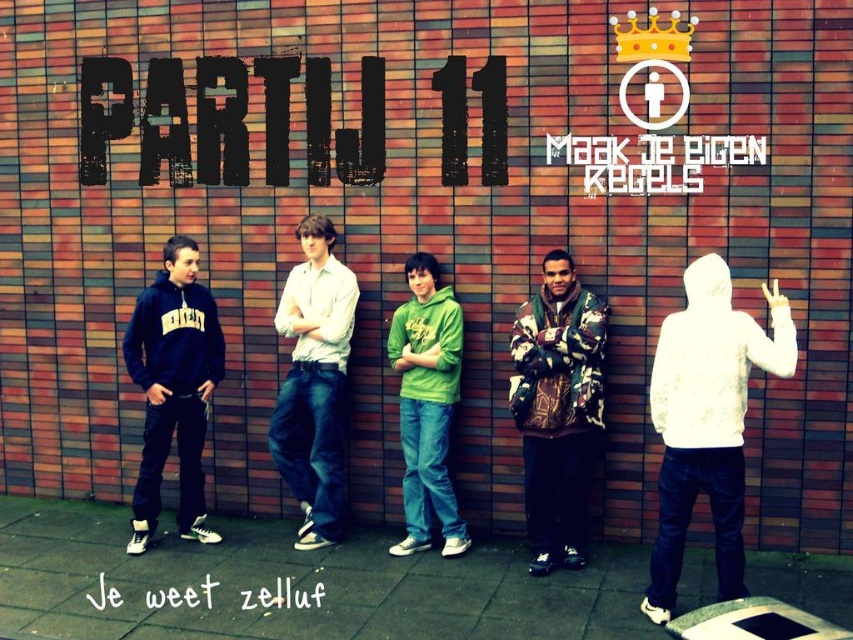
Question: Does white hoodie at center appear under light beige shirt at center?

Choices:
 (A) yes
 (B) no

Answer: (A)

Question: Estimate the real-world distances between objects in this image. Which object is farther from the camouflage jacket at center?

Choices:
 (A) light beige shirt at center
 (B) matte black hoodie at left

Answer: (B)

Question: Can you confirm if white hoodie at center is positioned below camouflage jacket at center?

Choices:
 (A) no
 (B) yes

Answer: (B)

Question: Can you confirm if white hoodie at center is thinner than green hoodie at center?

Choices:
 (A) yes
 (B) no

Answer: (B)

Question: Estimate the real-world distances between objects in this image. Which object is farther from the green hoodie at center?

Choices:
 (A) light beige shirt at center
 (B) camouflage jacket at center
 (C) white hoodie at center
 (D) matte black hoodie at left

Answer: (C)

Question: Which object appears farthest from the camera in this image?

Choices:
 (A) green hoodie at center
 (B) matte black hoodie at left

Answer: (A)